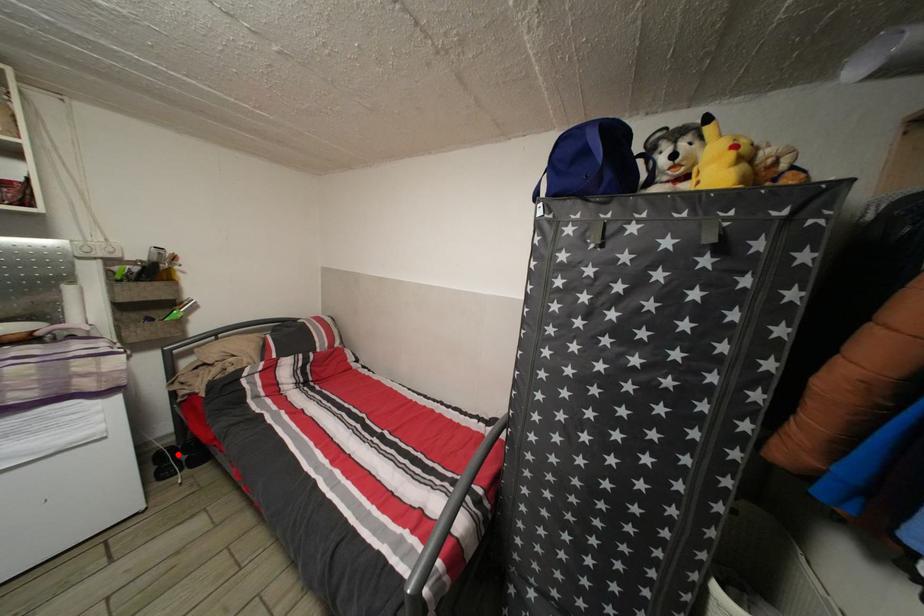
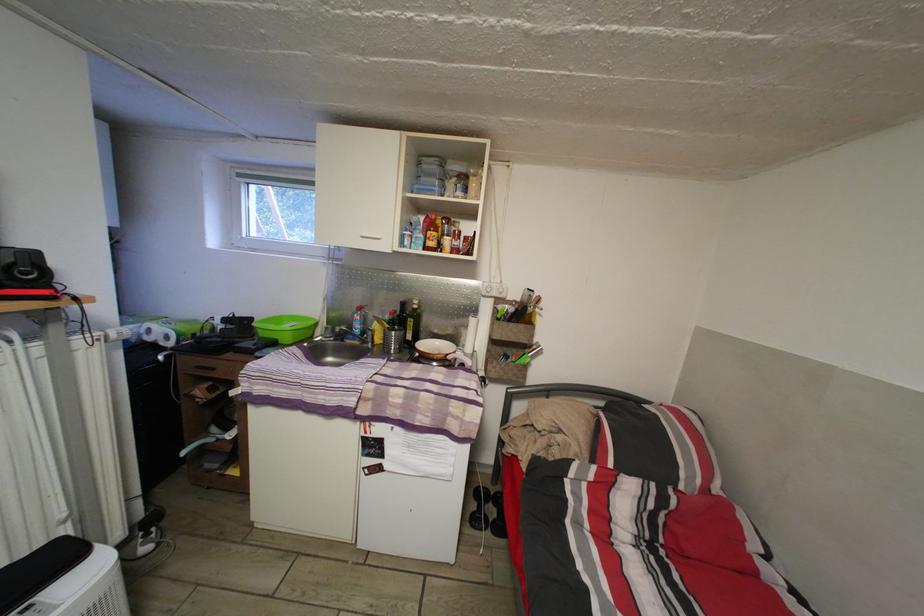
Question: I am providing you with two images of the same scene from different viewpoints. Image1 has a red point marked. In image2, the corresponding 3D location appears at what relative position? Reply with the corresponding letter.

Choices:
 (A) Closer
 (B) Farther

Answer: (B)